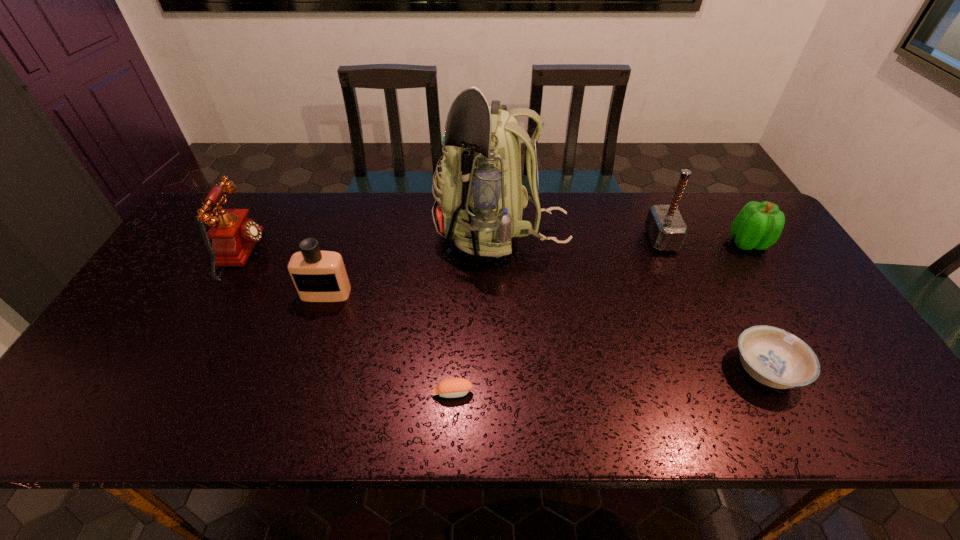
Locate an element on the screen. The image size is (960, 540). empty location between the leftmost object and the tallest object is located at coordinates (372, 245).

The image size is (960, 540). What are the coordinates of `free space between the hammer and the fifth tallest object` in the screenshot? It's located at (705, 241).

Locate an element on the screen. free space between the third shortest object and the bowl is located at coordinates (756, 306).

Where is `free point between the perfume and the sixth tallest object`? free point between the perfume and the sixth tallest object is located at coordinates (546, 332).

Where is `free space between the shortest object and the bowl`? This screenshot has height=540, width=960. free space between the shortest object and the bowl is located at coordinates (609, 381).

The height and width of the screenshot is (540, 960). Find the location of `the fifth closest object to the bell pepper`. the fifth closest object to the bell pepper is located at coordinates (319, 276).

Identify which object is the fifth closest to the sixth shortest object. Please provide its 2D coordinates. Your answer should be formatted as a tuple, i.e. [(x, y)], where the tuple contains the x and y coordinates of a point satisfying the conditions above.

[(319, 276)]

Find the location of a particular element. vacant space that satisfies the following two spatial constraints: 1. on the front-facing side of the backpack; 2. on the front label of the third nearest object is located at coordinates (504, 293).

Image resolution: width=960 pixels, height=540 pixels. I want to click on free region that satisfies the following two spatial constraints: 1. on the back side of the sushi; 2. on the dial of the telephone, so pyautogui.click(x=459, y=254).

At what (x,y) coordinates should I click in order to perform the action: click on vacant space that satisfies the following two spatial constraints: 1. on the dial of the telephone; 2. on the left side of the sixth tallest object. Please return your answer as a coordinate pair (x, y). The width and height of the screenshot is (960, 540). Looking at the image, I should click on (180, 370).